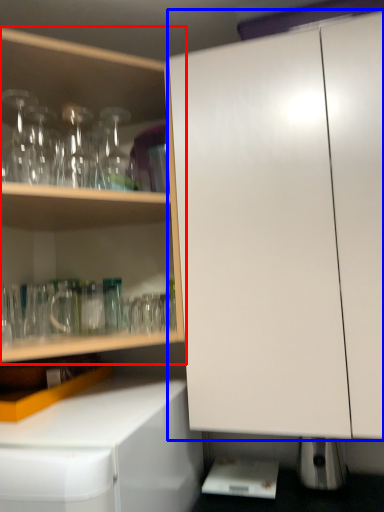
Question: Among these objects, which one is farthest to the camera, cabinetry (highlighted by a red box) or cabinetry (highlighted by a blue box)?

Choices:
 (A) cabinetry
 (B) cabinetry

Answer: (A)